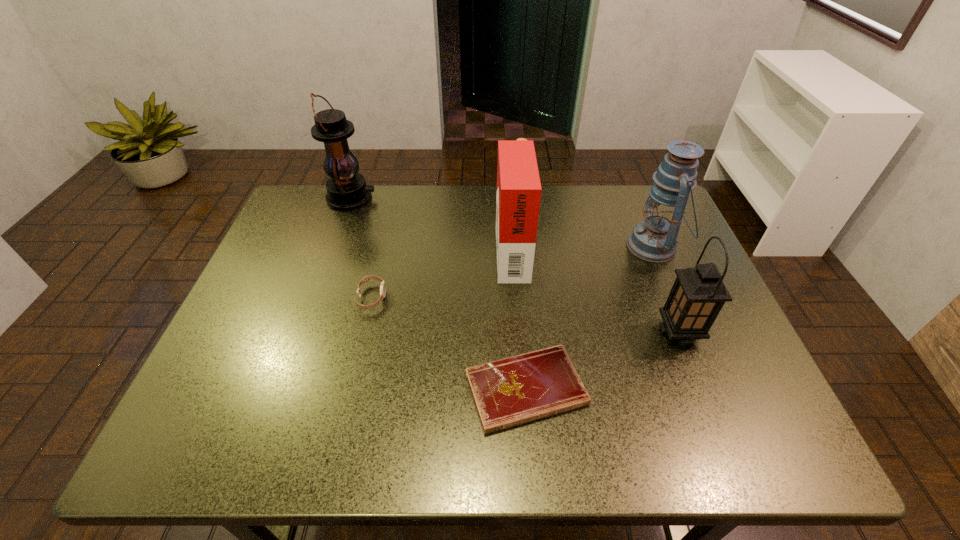
Identify the location of the leftmost lantern. This screenshot has height=540, width=960. (346, 189).

Identify the location of the farthest lantern. (346, 189).

In order to click on the second farthest lantern in this screenshot , I will do `click(655, 239)`.

Locate an element on the screen. cigarette case is located at coordinates (518, 197).

You are a GUI agent. You are given a task and a screenshot of the screen. Output one action in this format:
    pyautogui.click(x=<x>, y=<y>)
    Task: Click on the nearest lantern
    
    Given the screenshot: What is the action you would take?
    click(x=698, y=294)

This screenshot has height=540, width=960. Find the location of `the shortest lantern`. the shortest lantern is located at coordinates (698, 294).

Find the location of a particular element. The width and height of the screenshot is (960, 540). the second object from left to right is located at coordinates (365, 279).

Where is `watch`? Image resolution: width=960 pixels, height=540 pixels. watch is located at coordinates (365, 279).

Find the location of `notebook`. notebook is located at coordinates (509, 392).

You are a GUI agent. You are given a task and a screenshot of the screen. Output one action in this format:
    pyautogui.click(x=<x>, y=<y>)
    Task: Click on the nearest object
    The height and width of the screenshot is (540, 960).
    Given the screenshot: What is the action you would take?
    pyautogui.click(x=509, y=392)